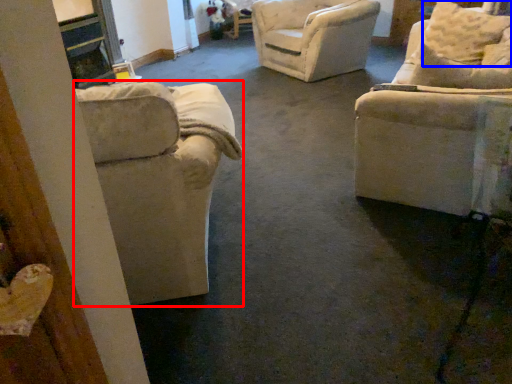
Question: Among these objects, which one is farthest to the camera, chair (highlighted by a red box) or pillow (highlighted by a blue box)?

Choices:
 (A) chair
 (B) pillow

Answer: (B)